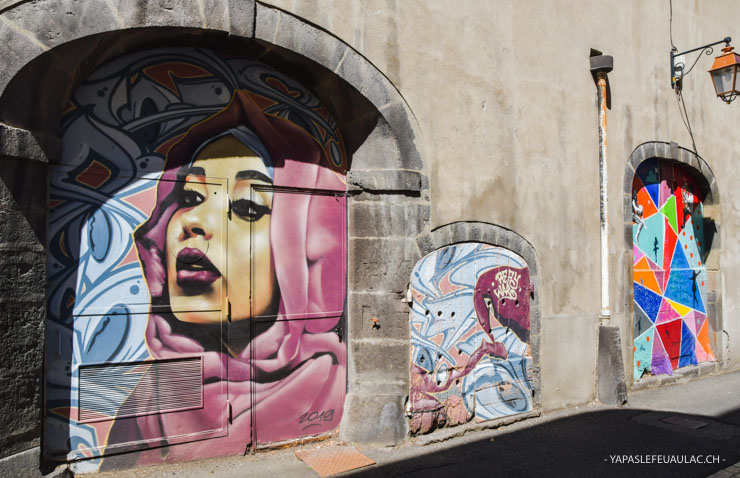
The height and width of the screenshot is (478, 740). Identify the location of door. (320, 342).